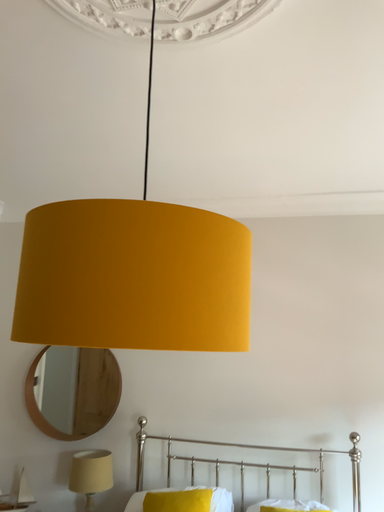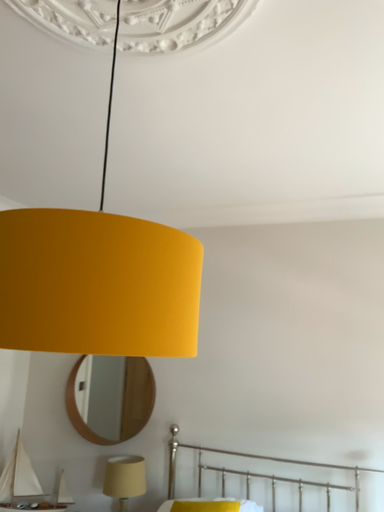
Question: Which way did the camera rotate in the video?

Choices:
 (A) rotated left
 (B) rotated right

Answer: (A)